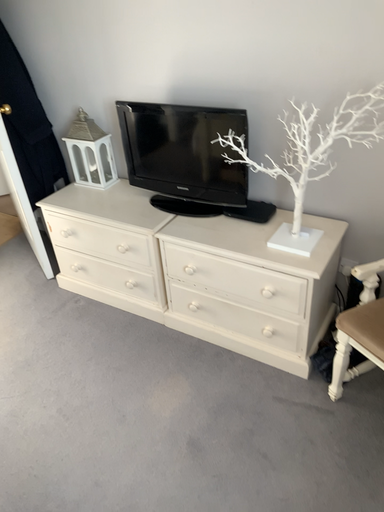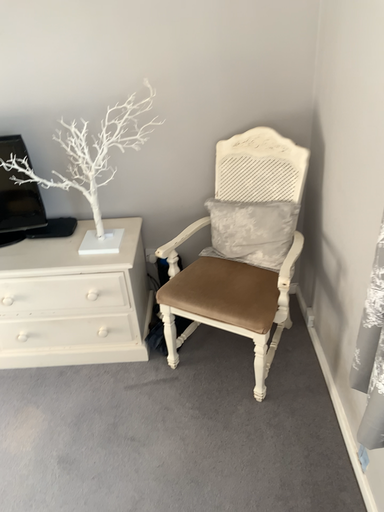
Question: Which way did the camera rotate in the video?

Choices:
 (A) rotated upward
 (B) rotated downward

Answer: (A)